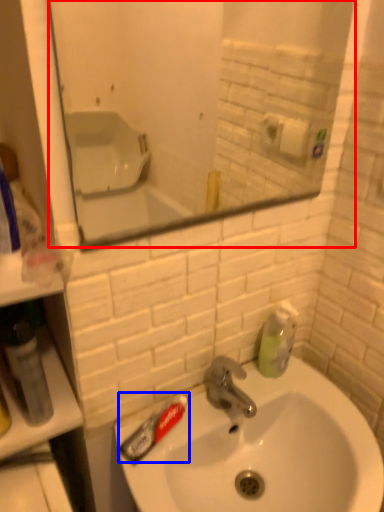
Question: Which point is closer to the camera, mirror (highlighted by a red box) or toothpaste (highlighted by a blue box)?

Choices:
 (A) mirror
 (B) toothpaste

Answer: (A)